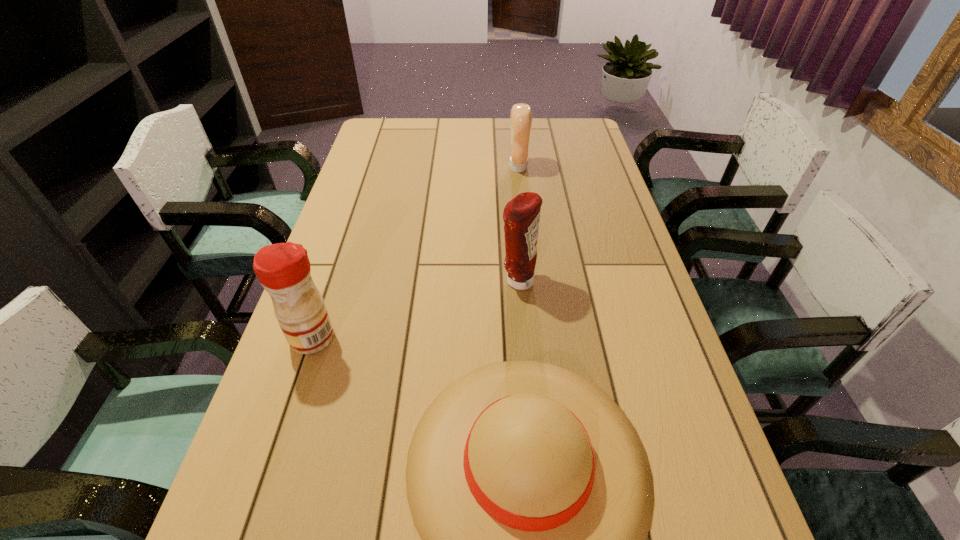
Locate an element on the screen. This screenshot has height=540, width=960. the nearest condiment is located at coordinates (283, 269).

Locate an element on the screen. the leftmost condiment is located at coordinates (283, 269).

Find the location of a particular element. the second nearest condiment is located at coordinates (521, 215).

The height and width of the screenshot is (540, 960). What are the coordinates of `the farthest condiment` in the screenshot? It's located at (521, 114).

What are the coordinates of `the farthest object` in the screenshot? It's located at (521, 114).

Where is `free location located on the back of the leftmost object`? This screenshot has height=540, width=960. free location located on the back of the leftmost object is located at coordinates (325, 299).

Identify the location of free spot located on the front of the second farthest condiment. This screenshot has width=960, height=540. (527, 399).

I want to click on free space located on the label of the farthest condiment, so click(x=448, y=167).

Find the location of a particular element. free space located 0.270m on the label of the farthest condiment is located at coordinates (431, 167).

This screenshot has width=960, height=540. I want to click on free region located 0.050m on the label of the farthest condiment, so click(x=493, y=167).